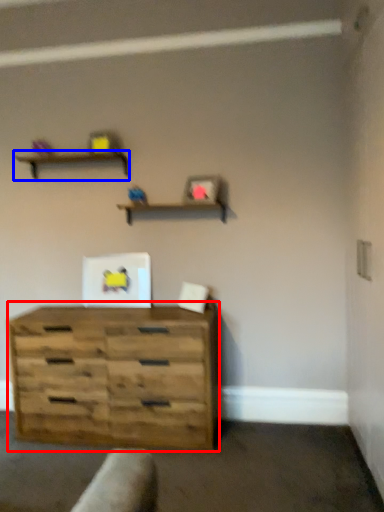
Question: Among these objects, which one is nearest to the camera, chest of drawers (highlighted by a red box) or shelf (highlighted by a blue box)?

Choices:
 (A) chest of drawers
 (B) shelf

Answer: (A)